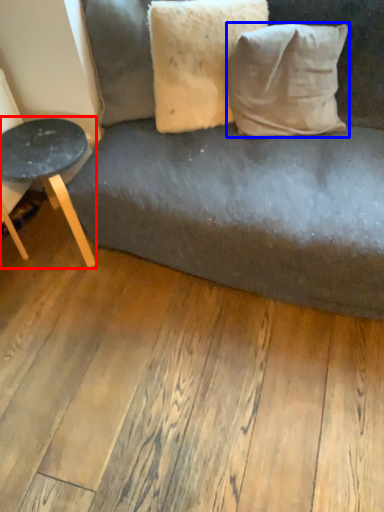
Question: Which object appears closest to the camera in this image, table (highlighted by a red box) or pillow (highlighted by a blue box)?

Choices:
 (A) table
 (B) pillow

Answer: (B)